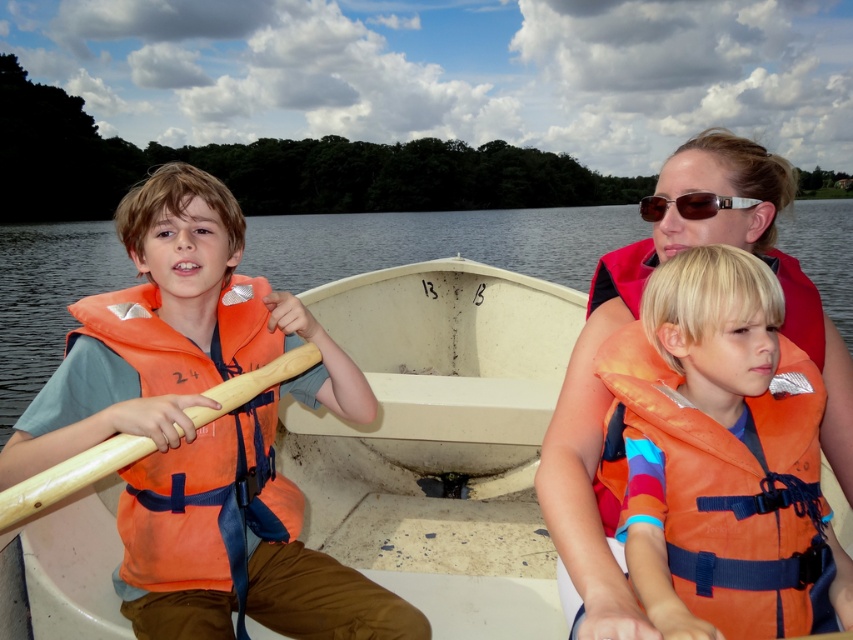
Question: Which of the following is the farthest from the observer?

Choices:
 (A) (640, 358)
 (B) (618, 218)
 (C) (457, 269)

Answer: (B)

Question: Can you confirm if orange life vest at center is positioned to the right of sunglasses at center?

Choices:
 (A) no
 (B) yes

Answer: (A)

Question: Is transparent water at boat center above sunglasses at center?

Choices:
 (A) yes
 (B) no

Answer: (A)

Question: Which is nearer to the white matte boat at center?

Choices:
 (A) wooden paddle at left
 (B) sunglasses at center
 (C) matte orange life vest at left

Answer: (C)

Question: Estimate the real-world distances between objects in this image. Which object is closer to the wooden paddle at left?

Choices:
 (A) sunglasses at center
 (B) transparent water at boat center
 (C) white matte boat at center

Answer: (A)

Question: Is matte orange life vest at left to the right of sunglasses at center from the viewer's perspective?

Choices:
 (A) yes
 (B) no

Answer: (B)